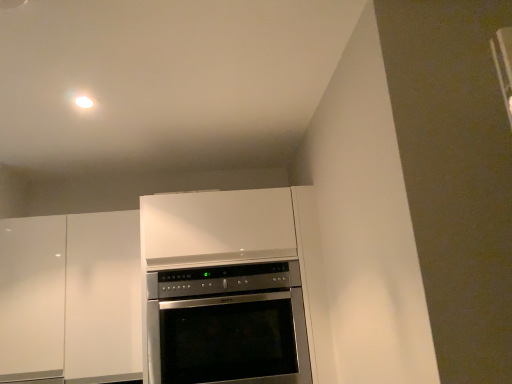
In order to click on satin silver oven at center in this screenshot , I will do `click(228, 325)`.

The height and width of the screenshot is (384, 512). What do you see at coordinates (228, 325) in the screenshot?
I see `satin silver oven at center` at bounding box center [228, 325].

Measure the distance between satin silver oven at center and camera.

5.03 feet.

The height and width of the screenshot is (384, 512). What do you see at coordinates (71, 296) in the screenshot?
I see `white glossy cabinet at left` at bounding box center [71, 296].

Where is `white glossy cabinet at left`? The width and height of the screenshot is (512, 384). white glossy cabinet at left is located at coordinates (71, 296).

Measure the distance between point (121, 233) and camera.

They are 1.89 meters apart.

At what (x,y) coordinates should I click in order to perform the action: click on satin silver oven at center. Please return your answer as a coordinate pair (x, y). The height and width of the screenshot is (384, 512). Looking at the image, I should click on (228, 325).

Which is more to the left, satin silver oven at center or white glossy cabinet at left?

Positioned to the left is white glossy cabinet at left.

Which object is closer to the camera, satin silver oven at center or white glossy cabinet at left?

satin silver oven at center.

Considering the positions of point (232, 278) and point (4, 240), is point (232, 278) closer or farther from the camera than point (4, 240)?

Point (232, 278) is positioned closer to the camera compared to point (4, 240).

From the image's perspective, does satin silver oven at center appear lower than white glossy cabinet at left?

Yes.

From a real-world perspective, which is physically above, satin silver oven at center or white glossy cabinet at left?

white glossy cabinet at left.

Can you confirm if satin silver oven at center is thinner than white glossy cabinet at left?

Incorrect, the width of satin silver oven at center is not less than that of white glossy cabinet at left.

Can you confirm if satin silver oven at center is shorter than white glossy cabinet at left?

Indeed, satin silver oven at center has a lesser height compared to white glossy cabinet at left.

Considering the relative sizes of satin silver oven at center and white glossy cabinet at left in the image provided, is satin silver oven at center smaller than white glossy cabinet at left?

Correct, satin silver oven at center occupies less space than white glossy cabinet at left.

Is satin silver oven at center positioned beyond the bounds of white glossy cabinet at left?

That's correct, satin silver oven at center is outside of white glossy cabinet at left.

Is satin silver oven at center far away from white glossy cabinet at left?

That's not correct — satin silver oven at center is a little close to white glossy cabinet at left.

Is satin silver oven at center facing towards white glossy cabinet at left?

No, satin silver oven at center does not turn towards white glossy cabinet at left.

How different are the orientations of satin silver oven at center and white glossy cabinet at left in degrees?

0.00105 degrees separate the facing orientations of satin silver oven at center and white glossy cabinet at left.

How distant is satin silver oven at center from white glossy cabinet at left?

A distance of 46.01 centimeters exists between satin silver oven at center and white glossy cabinet at left.

You are a GUI agent. You are given a task and a screenshot of the screen. Output one action in this format:
    pyautogui.click(x=<x>, y=<y>)
    Task: Click on the oven on the right of white glossy cabinet at left
    
    Given the screenshot: What is the action you would take?
    pyautogui.click(x=228, y=325)

Is white glossy cabinet at left to the left of satin silver oven at center from the viewer's perspective?

Yes.

Considering the relative positions of white glossy cabinet at left and satin silver oven at center in the image provided, is white glossy cabinet at left in front of satin silver oven at center?

No, the depth of white glossy cabinet at left is greater than that of satin silver oven at center.

Is point (91, 380) closer or farther from the camera than point (234, 305)?

Point (91, 380) is positioned farther from the camera compared to point (234, 305).

From the image's perspective, would you say white glossy cabinet at left is shown under satin silver oven at center?

No, from the image's perspective, white glossy cabinet at left is not beneath satin silver oven at center.

From a real-world perspective, is white glossy cabinet at left positioned above or below satin silver oven at center?

From a real-world perspective, white glossy cabinet at left is physically above satin silver oven at center.

Considering the sizes of objects white glossy cabinet at left and satin silver oven at center in the image provided, who is wider, white glossy cabinet at left or satin silver oven at center?

satin silver oven at center is wider.

Which of these two, white glossy cabinet at left or satin silver oven at center, stands taller?

white glossy cabinet at left is taller.

Can you confirm if white glossy cabinet at left is bigger than satin silver oven at center?

Yes.

Can satin silver oven at center be found inside white glossy cabinet at left?

No.

Is the surface of white glossy cabinet at left in direct contact with satin silver oven at center?

No, white glossy cabinet at left is not with satin silver oven at center.

From the picture: Is white glossy cabinet at left facing towards satin silver oven at center?

No, white glossy cabinet at left is not facing towards satin silver oven at center.

How different are the orientations of white glossy cabinet at left and satin silver oven at center in degrees?

The angular difference between white glossy cabinet at left and satin silver oven at center is 0.00105 degrees.

Measure the distance between white glossy cabinet at left and satin silver oven at center.

A distance of 18.11 inches exists between white glossy cabinet at left and satin silver oven at center.

This screenshot has width=512, height=384. Identify the location of oven that appears on the right of white glossy cabinet at left. (228, 325).

Identify the location of oven below the white glossy cabinet at left (from a real-world perspective). This screenshot has width=512, height=384. (228, 325).

This screenshot has width=512, height=384. I want to click on cabinetry that is above the satin silver oven at center (from a real-world perspective), so click(x=71, y=296).